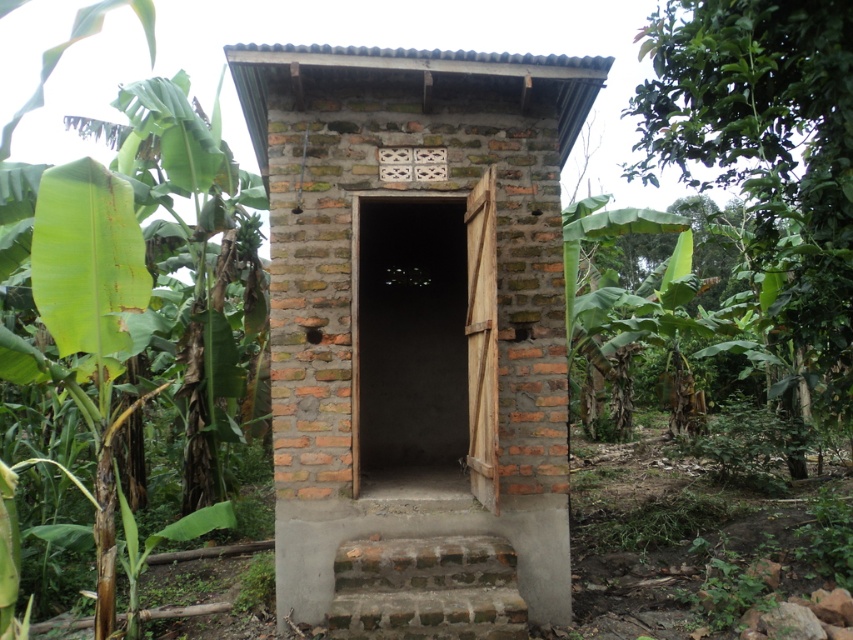
You are standing in front of the brick structure and see a point marked at coordinate (416, 332). Based on the scene, can you determine what surface this point is located on?

The point is located on the brick wall of the brick structure at the center.